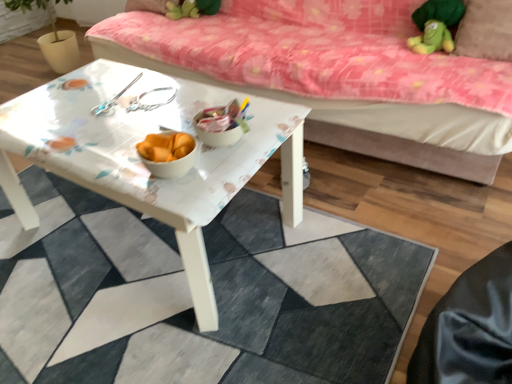
Question: Does point (492, 3) appear closer or farther from the camera than point (348, 337)?

Choices:
 (A) closer
 (B) farther

Answer: (B)

Question: In terms of height, does brown fabric pillow at upper right look taller or shorter compared to white glossy table at center?

Choices:
 (A) tall
 (B) short

Answer: (A)

Question: Which object is the farthest from the green plush toy at upper center?

Choices:
 (A) brown fabric pillow at upper right
 (B) pink floral fabric studio couch at upper center
 (C) white glossy table at center
 (D) white glossy table at center

Answer: (C)

Question: Based on their relative distances, which object is nearer to the green plush toy at upper center?

Choices:
 (A) white glossy table at center
 (B) pink floral fabric studio couch at upper center
 (C) white glossy table at center
 (D) brown fabric pillow at upper right

Answer: (B)